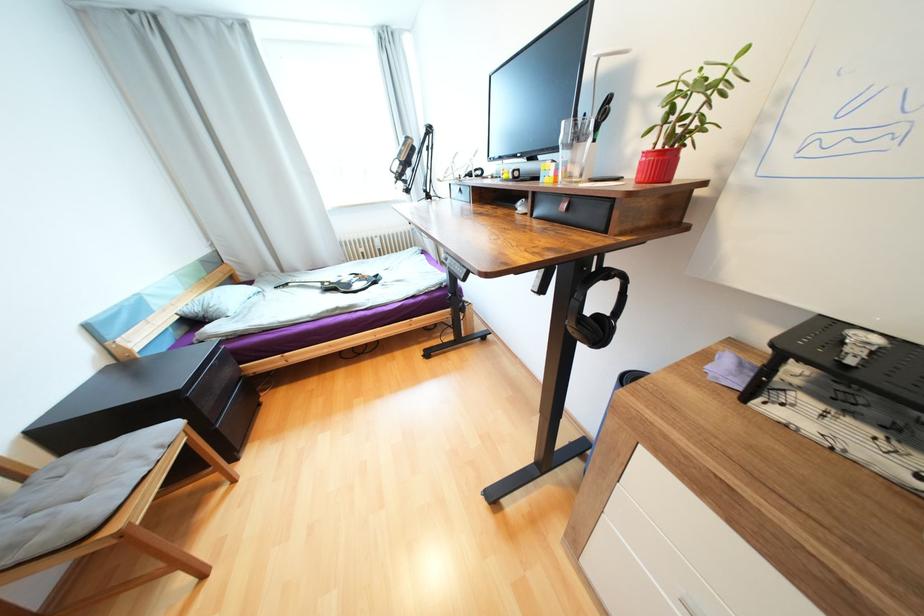
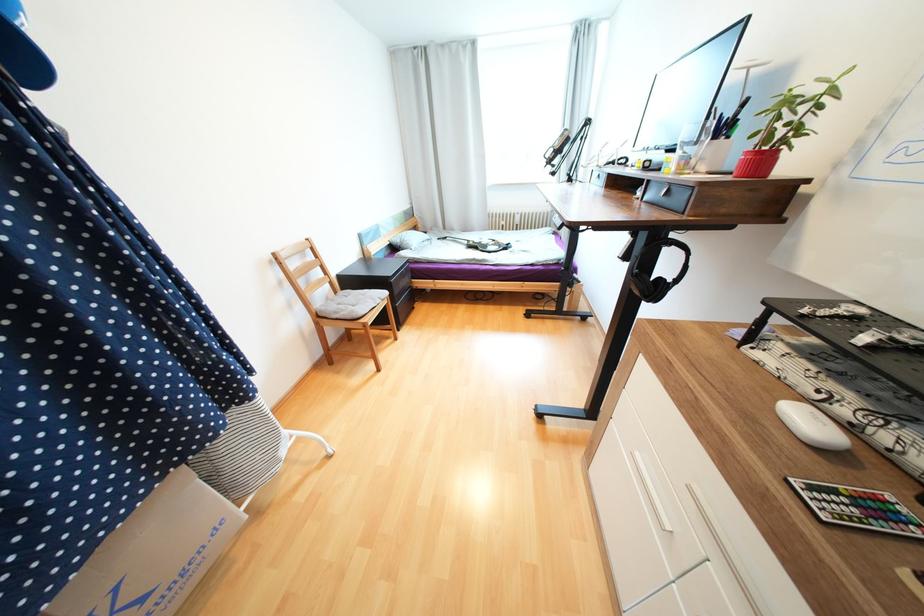
Locate, in the second image, the point that corresponds to point 538,159 in the first image.

(676, 151)